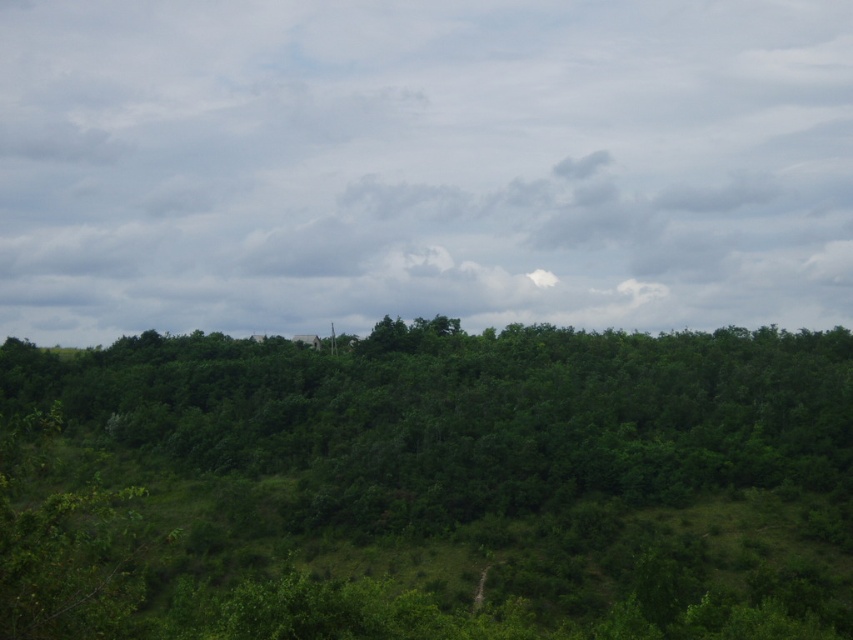
Question: Is cloudy sky at upper center positioned behind green leafy forest at center?

Choices:
 (A) yes
 (B) no

Answer: (A)

Question: Is cloudy sky at upper center closer to camera compared to green leafy forest at center?

Choices:
 (A) no
 (B) yes

Answer: (A)

Question: Which point is farther to the camera?

Choices:
 (A) (740, 52)
 (B) (268, 584)

Answer: (A)

Question: Which of the following is the closest to the observer?

Choices:
 (A) (196, 61)
 (B) (55, 476)

Answer: (B)

Question: Which point is closer to the camera taking this photo?

Choices:
 (A) (486, 8)
 (B) (631, 401)

Answer: (B)

Question: Is cloudy sky at upper center wider than green leafy forest at center?

Choices:
 (A) yes
 (B) no

Answer: (A)